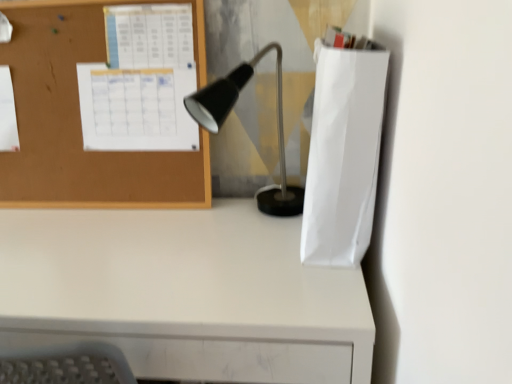
Question: From a real-world perspective, does matte black lamp at center sit lower than white matte paper bag at right?

Choices:
 (A) no
 (B) yes

Answer: (B)

Question: Is matte black lamp at center bigger than white matte paper bag at right?

Choices:
 (A) no
 (B) yes

Answer: (B)

Question: Is matte black lamp at center thinner than white matte paper bag at right?

Choices:
 (A) no
 (B) yes

Answer: (A)

Question: Is matte black lamp at center in contact with white matte paper bag at right?

Choices:
 (A) yes
 (B) no

Answer: (B)

Question: Is there a large distance between matte black lamp at center and white matte paper bag at right?

Choices:
 (A) yes
 (B) no

Answer: (B)

Question: Is matte black lamp at center to the left or to the right of corkboard at upper left in the image?

Choices:
 (A) left
 (B) right

Answer: (B)

Question: From the image's perspective, is matte black lamp at center above or below corkboard at upper left?

Choices:
 (A) above
 (B) below

Answer: (B)

Question: Based on their sizes in the image, would you say matte black lamp at center is bigger or smaller than corkboard at upper left?

Choices:
 (A) big
 (B) small

Answer: (A)

Question: Is matte black lamp at center in front of or behind corkboard at upper left in the image?

Choices:
 (A) front
 (B) behind

Answer: (A)

Question: Relative to matte black lamp at center, is white matte desk at lower left in front or behind?

Choices:
 (A) behind
 (B) front

Answer: (B)

Question: Is point (98, 264) positioned closer to the camera than point (278, 215)?

Choices:
 (A) closer
 (B) farther

Answer: (A)

Question: From their relative heights in the image, would you say white matte desk at lower left is taller or shorter than matte black lamp at center?

Choices:
 (A) short
 (B) tall

Answer: (B)

Question: From the image's perspective, relative to matte black lamp at center, is white matte desk at lower left above or below?

Choices:
 (A) above
 (B) below

Answer: (B)

Question: Does point (195, 119) appear closer or farther from the camera than point (374, 155)?

Choices:
 (A) closer
 (B) farther

Answer: (B)

Question: Looking at their shapes, would you say matte black lamp at center is wider or thinner than white matte paper bag at right?

Choices:
 (A) wide
 (B) thin

Answer: (A)